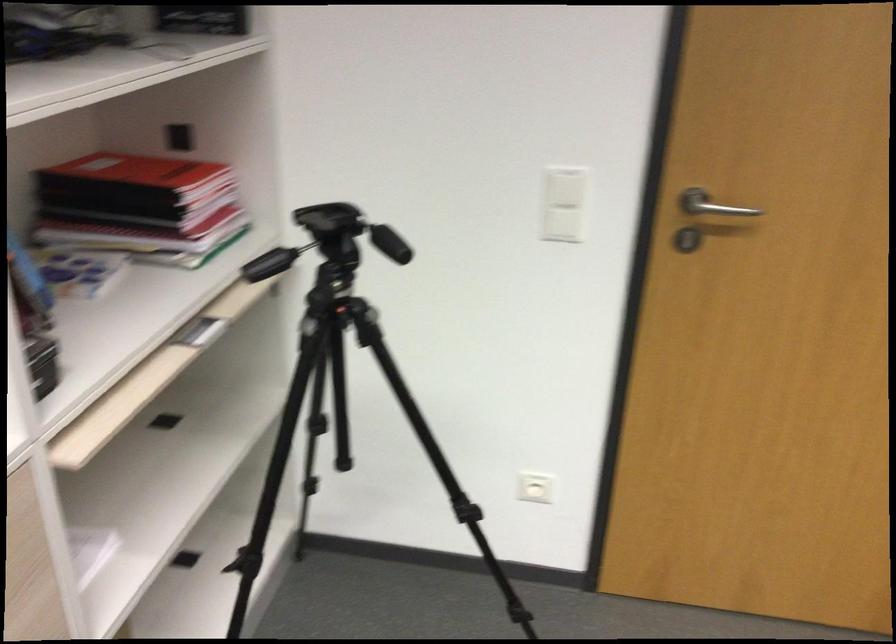
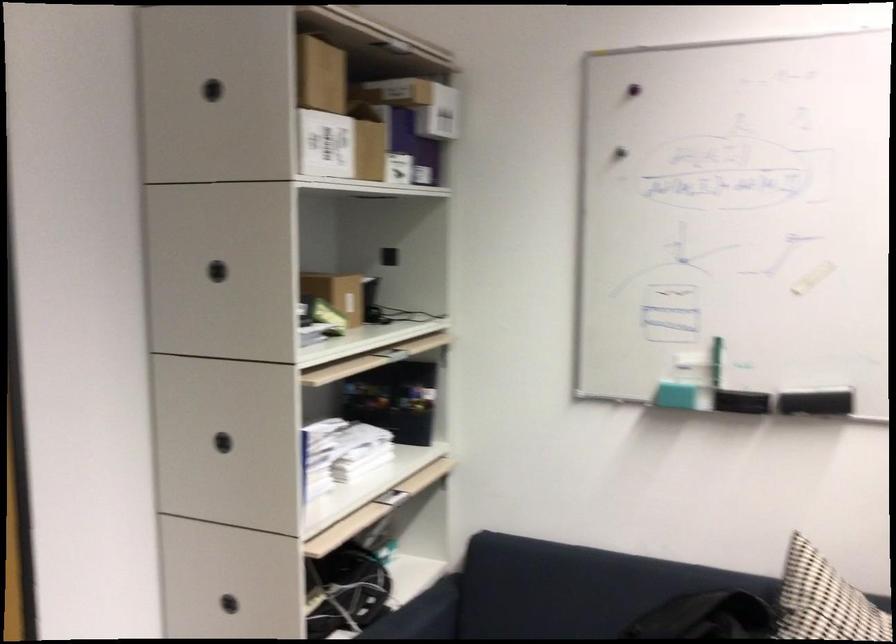
Question: The camera is either moving clockwise (left) or counter-clockwise (right) around the object. The first image is from the beginning of the video and the second image is from the end. Is the camera moving left or right when shooting the video?

Choices:
 (A) Left
 (B) Right

Answer: (A)